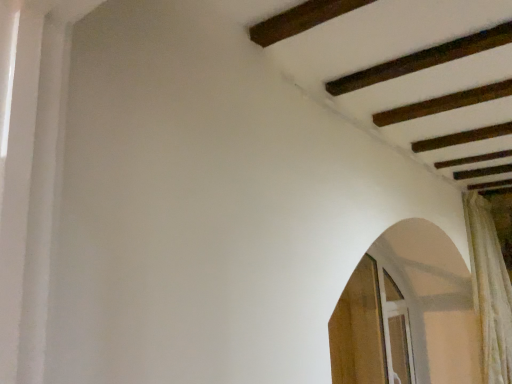
Question: From their relative heights in the image, would you say wooden screen door at lower right, the second screen door viewed from the right, is taller or shorter than white textured curtain at right?

Choices:
 (A) tall
 (B) short

Answer: (B)

Question: In terms of size, does wooden screen door at lower right, the second screen door viewed from the right, appear bigger or smaller than white textured curtain at right?

Choices:
 (A) big
 (B) small

Answer: (B)

Question: Estimate the real-world distances between objects in this image. Which object is closer to the wooden screen door at lower right, positioned as the first screen door in left-to-right order?

Choices:
 (A) white textured curtain at right
 (B) clear glass screen door at lower right, which is counted as the first screen door, starting from the right

Answer: (B)

Question: Estimate the real-world distances between objects in this image. Which object is farther from the wooden screen door at lower right, positioned as the first screen door in left-to-right order?

Choices:
 (A) clear glass screen door at lower right, which is counted as the first screen door, starting from the right
 (B) white textured curtain at right

Answer: (B)